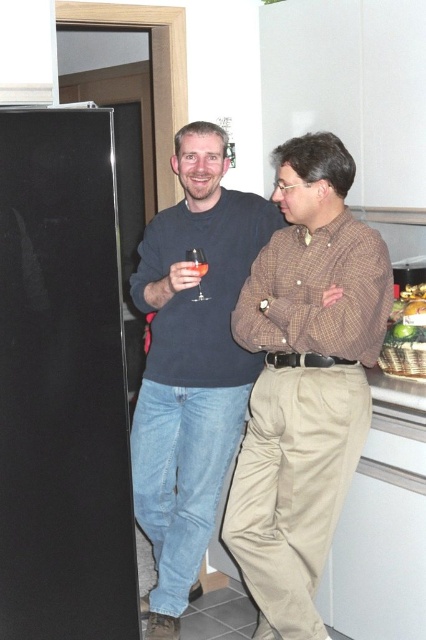
You are a GUI agent. You are given a task and a screenshot of the screen. Output one action in this format:
    pyautogui.click(x=<x>, y=<y>)
    Task: Click on the brown checkered shirt at center
    
    Given the screenshot: What is the action you would take?
    pyautogui.click(x=304, y=381)

Locate an element on the screen. Image resolution: width=426 pixels, height=640 pixels. brown checkered shirt at center is located at coordinates tap(304, 381).

Is dark blue sweater at center closer to the viewer compared to translucent glass wine at center?

No, it is not.

Can you confirm if dark blue sweater at center is positioned below translucent glass wine at center?

Correct, dark blue sweater at center is located below translucent glass wine at center.

Between point (207, 241) and point (201, 260), which one is positioned behind?

Positioned behind is point (207, 241).

At what (x,y) coordinates should I click in order to perform the action: click on dark blue sweater at center. Please return your answer as a coordinate pair (x, y). Looking at the image, I should click on (192, 364).

Where is `brown checkered shirt at center`? The width and height of the screenshot is (426, 640). brown checkered shirt at center is located at coordinates (304, 381).

Who is positioned more to the right, brown checkered shirt at center or dark blue sweater at center?

From the viewer's perspective, brown checkered shirt at center appears more on the right side.

Does point (304, 227) come closer to viewer compared to point (201, 493)?

Yes, it is in front of point (201, 493).

The width and height of the screenshot is (426, 640). I want to click on brown checkered shirt at center, so click(x=304, y=381).